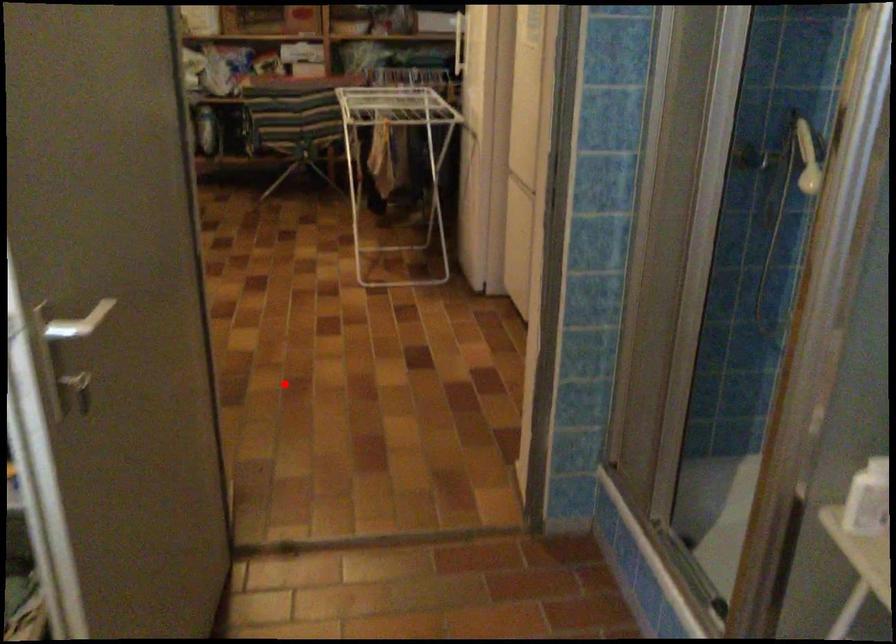
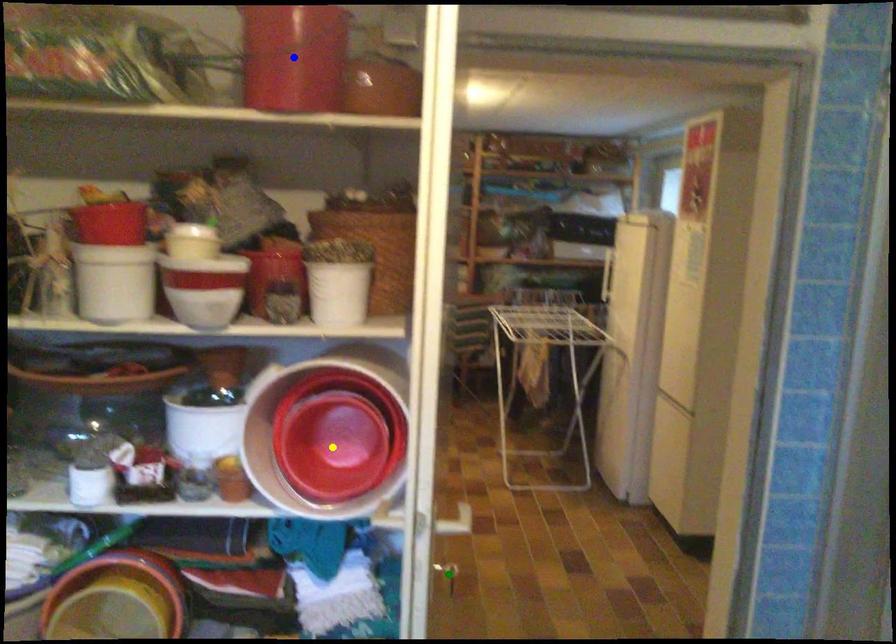
Question: I am providing you with two images of the same scene from different viewpoints. A red point is marked on the first image. You are given multiple points on the second image. Can you choose the point in image 2 that corresponds to the point in image 1?

Choices:
 (A) green point
 (B) yellow point
 (C) blue point

Answer: (A)